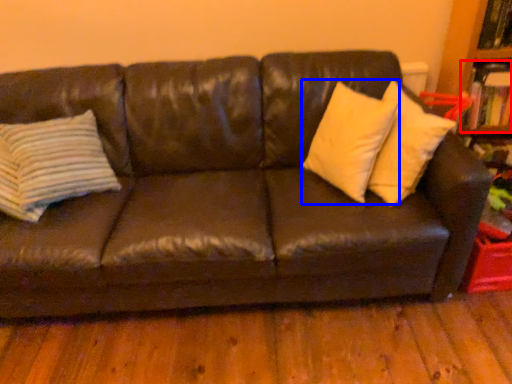
Question: Which of the following is the farthest to the observer, book (highlighted by a red box) or pillow (highlighted by a blue box)?

Choices:
 (A) book
 (B) pillow

Answer: (A)